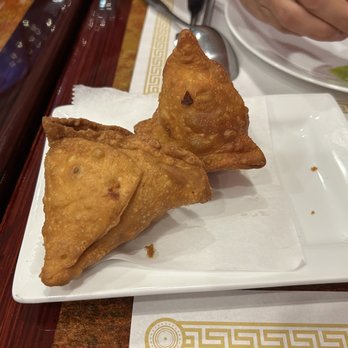
This screenshot has height=348, width=348. Identify the location of cl;oth on table. (262, 78), (238, 306).